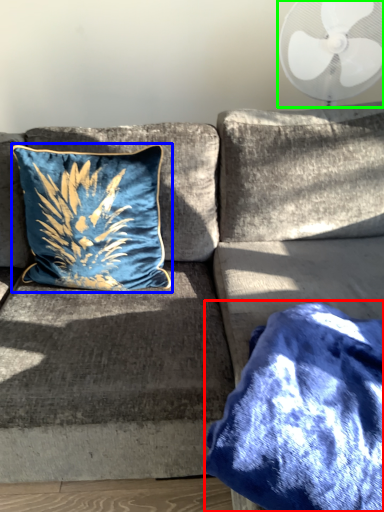
Question: Which object is positioned closest to blanket (highlighted by a red box)? Select from pillow (highlighted by a blue box) and mechanical fan (highlighted by a green box).

Choices:
 (A) pillow
 (B) mechanical fan

Answer: (A)